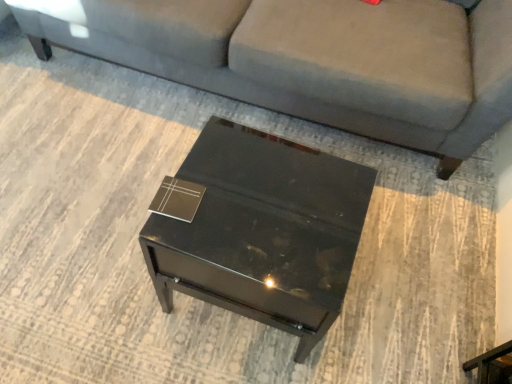
Question: Could you tell me if glossy black side table at center is turned towards matte black book at center?

Choices:
 (A) no
 (B) yes

Answer: (A)

Question: Can you confirm if glossy black side table at center is bigger than matte black book at center?

Choices:
 (A) yes
 (B) no

Answer: (A)

Question: Would you say glossy black side table at center is a long distance from matte black book at center?

Choices:
 (A) no
 (B) yes

Answer: (A)

Question: From a real-world perspective, does glossy black side table at center stand above matte black book at center?

Choices:
 (A) yes
 (B) no

Answer: (B)

Question: Is glossy black side table at center taller than matte black book at center?

Choices:
 (A) yes
 (B) no

Answer: (A)

Question: Is glossy black side table at center to the left of matte black book at center from the viewer's perspective?

Choices:
 (A) yes
 (B) no

Answer: (B)

Question: Is glossy black side table at center further to the viewer compared to gray fabric couch at center?

Choices:
 (A) no
 (B) yes

Answer: (A)

Question: Can you confirm if glossy black side table at center is positioned to the right of gray fabric couch at center?

Choices:
 (A) yes
 (B) no

Answer: (B)

Question: Is glossy black side table at center not close to gray fabric couch at center?

Choices:
 (A) yes
 (B) no

Answer: (B)

Question: Would you say gray fabric couch at center is part of glossy black side table at center's contents?

Choices:
 (A) no
 (B) yes

Answer: (A)

Question: Is glossy black side table at center bigger than gray fabric couch at center?

Choices:
 (A) no
 (B) yes

Answer: (A)

Question: Considering the relative sizes of glossy black side table at center and gray fabric couch at center in the image provided, is glossy black side table at center shorter than gray fabric couch at center?

Choices:
 (A) no
 (B) yes

Answer: (B)

Question: Is matte black book at center closer to camera compared to glossy black side table at center?

Choices:
 (A) yes
 (B) no

Answer: (B)